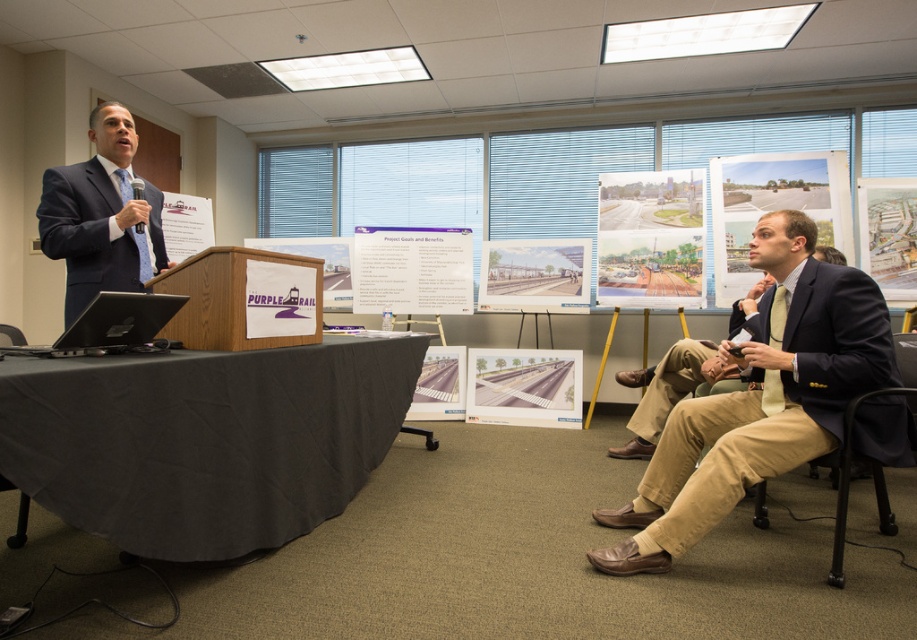
You are organizing a presentation and need to place two handouts on the table. The matte paper train station at center and the white paper at left are already on the table. Where should you place a new handout so it doesn not block either of them?

Place the new handout to the left of the white paper at left or to the right of the matte paper train station at center to avoid blocking them.

From the picture: You are an attendee at the presentation and want to see both the matte paper poster at upper right and the purple cardboard sign at center. Which one is placed higher in the room?

The matte paper poster at upper right is positioned over the purple cardboard sign at center, so it is placed higher.